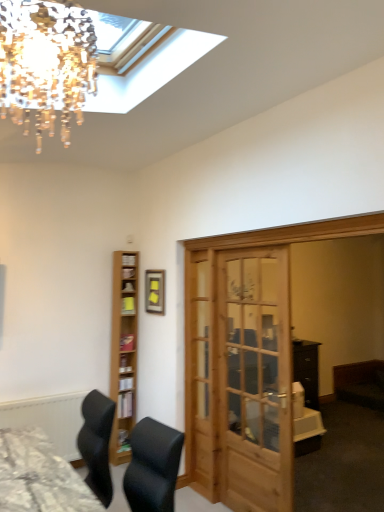
The height and width of the screenshot is (512, 384). Describe the element at coordinates (46, 64) in the screenshot. I see `crystal glass chandelier at upper left` at that location.

Locate an element on the screen. The image size is (384, 512). textured gray desk at lower left is located at coordinates (39, 476).

The height and width of the screenshot is (512, 384). Describe the element at coordinates (239, 377) in the screenshot. I see `wooden door at center` at that location.

Measure the distance between point [194,437] and camera.

They are 11.73 feet apart.

Locate an element on the screen. light brown wooden shelf at left is located at coordinates (123, 352).

Considering the relative sizes of textured gray desk at lower left and light brown wooden shelf at left in the image provided, is textured gray desk at lower left taller than light brown wooden shelf at left?

Incorrect, the height of textured gray desk at lower left is not larger of that of light brown wooden shelf at left.

Where is `desk on the left side of light brown wooden shelf at left`? This screenshot has height=512, width=384. desk on the left side of light brown wooden shelf at left is located at coordinates (39, 476).

From a real-world perspective, is textured gray desk at lower left above or below light brown wooden shelf at left?

In terms of real-world spatial position, textured gray desk at lower left is below light brown wooden shelf at left.

Considering the relative sizes of wooden door at center and textured gray desk at lower left in the image provided, is wooden door at center taller than textured gray desk at lower left?

Yes, wooden door at center is taller than textured gray desk at lower left.

Is wooden door at center aimed at textured gray desk at lower left?

Yes, wooden door at center is facing textured gray desk at lower left.

Does wooden door at center have a lesser width compared to textured gray desk at lower left?

Yes.

Which is in front, crystal glass chandelier at upper left or matte black picture frame at center?

crystal glass chandelier at upper left is more forward.

Based on the photo, does crystal glass chandelier at upper left have a lesser width compared to matte black picture frame at center?

No.

Between crystal glass chandelier at upper left and matte black picture frame at center, which one appears on the right side from the viewer's perspective?

crystal glass chandelier at upper left is more to the right.

From a real-world perspective, is crystal glass chandelier at upper left physically below matte black picture frame at center?

No, from a real-world perspective, crystal glass chandelier at upper left is not below matte black picture frame at center.

Which object is more forward, light brown wooden shelf at left or crystal glass chandelier at upper left?

crystal glass chandelier at upper left is more forward.

Can you confirm if light brown wooden shelf at left is bigger than crystal glass chandelier at upper left?

Indeed, light brown wooden shelf at left has a larger size compared to crystal glass chandelier at upper left.

From the image's perspective, is light brown wooden shelf at left positioned above or below crystal glass chandelier at upper left?

Based on their image positions, light brown wooden shelf at left is located beneath crystal glass chandelier at upper left.

The image size is (384, 512). Identify the location of picture frame behind the wooden door at center. (155, 291).

Does wooden door at center turn towards matte black picture frame at center?

No, wooden door at center is not turned towards matte black picture frame at center.

Is the position of wooden door at center less distant than that of matte black picture frame at center?

Yes, it is.

Does point (205, 356) come closer to viewer compared to point (153, 302)?

Yes, it is.

Does point (162, 271) come in front of point (6, 508)?

No, (162, 271) is behind (6, 508).

Based on their sizes in the image, would you say matte black picture frame at center is bigger or smaller than textured gray desk at lower left?

Clearly, matte black picture frame at center is smaller in size than textured gray desk at lower left.

In the scene shown: Is matte black picture frame at center positioned behind textured gray desk at lower left?

Yes, it is.

Is matte black picture frame at center looking in the opposite direction of textured gray desk at lower left?

No, matte black picture frame at center's orientation is not away from textured gray desk at lower left.

Could you tell me if matte black picture frame at center is turned towards light brown wooden shelf at left?

No, matte black picture frame at center does not turn towards light brown wooden shelf at left.

Considering their positions, is matte black picture frame at center located in front of or behind light brown wooden shelf at left?

Clearly, matte black picture frame at center is in front of light brown wooden shelf at left.

Is matte black picture frame at center placed right next to light brown wooden shelf at left?

No, matte black picture frame at center is not next to light brown wooden shelf at left.

The height and width of the screenshot is (512, 384). Find the location of `picture frame lying on the right of light brown wooden shelf at left`. picture frame lying on the right of light brown wooden shelf at left is located at coordinates (155, 291).

This screenshot has width=384, height=512. I want to click on desk on the left of light brown wooden shelf at left, so click(x=39, y=476).

The height and width of the screenshot is (512, 384). I want to click on door on the right side of textured gray desk at lower left, so click(239, 377).

When comparing their distances from light brown wooden shelf at left, does crystal glass chandelier at upper left or wooden door at center seem further?

crystal glass chandelier at upper left is positioned further to the anchor light brown wooden shelf at left.

Which object lies further to the anchor point textured gray desk at lower left, light brown wooden shelf at left or wooden door at center?

Based on the image, light brown wooden shelf at left appears to be further to textured gray desk at lower left.

Estimate the real-world distances between objects in this image. Which object is further from textured gray desk at lower left, crystal glass chandelier at upper left or light brown wooden shelf at left?

The object further to textured gray desk at lower left is crystal glass chandelier at upper left.

From the image, which object appears to be nearer to crystal glass chandelier at upper left, matte black picture frame at center or light brown wooden shelf at left?

matte black picture frame at center.

Which object lies further to the anchor point textured gray desk at lower left, matte black picture frame at center or crystal glass chandelier at upper left?

Among the two, crystal glass chandelier at upper left is located further to textured gray desk at lower left.

From the image, which object appears to be nearer to light brown wooden shelf at left, crystal glass chandelier at upper left or matte black picture frame at center?

Among the two, matte black picture frame at center is located nearer to light brown wooden shelf at left.

Looking at the image, which one is located closer to textured gray desk at lower left, crystal glass chandelier at upper left or matte black picture frame at center?

matte black picture frame at center.

Estimate the real-world distances between objects in this image. Which object is closer to crystal glass chandelier at upper left, matte black picture frame at center or wooden door at center?

A: The object closer to crystal glass chandelier at upper left is wooden door at center.

I want to click on desk located between crystal glass chandelier at upper left and matte black picture frame at center in the depth direction, so click(x=39, y=476).

Where is `door between crystal glass chandelier at upper left and matte black picture frame at center from front to back`? The width and height of the screenshot is (384, 512). door between crystal glass chandelier at upper left and matte black picture frame at center from front to back is located at coordinates (239, 377).

Identify the location of picture frame between crystal glass chandelier at upper left and light brown wooden shelf at left in the front-back direction. (155, 291).

The image size is (384, 512). In order to click on door positioned between crystal glass chandelier at upper left and light brown wooden shelf at left from near to far in this screenshot , I will do `click(239, 377)`.